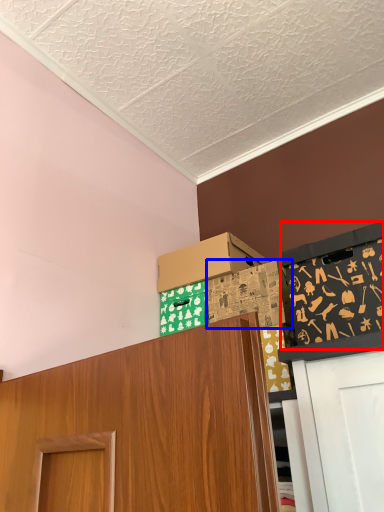
Question: Which point is further to the camera, bulletin board (highlighted by a red box) or box (highlighted by a blue box)?

Choices:
 (A) bulletin board
 (B) box

Answer: (B)